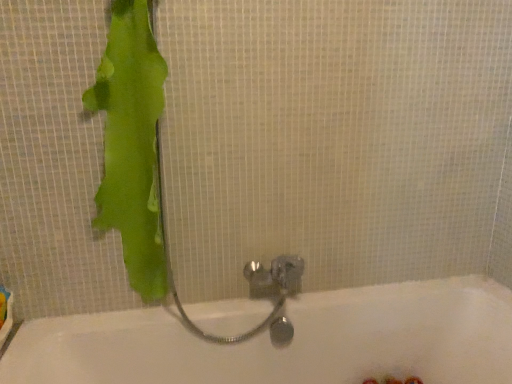
What do you see at coordinates (291, 343) in the screenshot? I see `white glossy bathtub at center` at bounding box center [291, 343].

Locate an element on the screen. This screenshot has width=512, height=384. white glossy bathtub at center is located at coordinates (291, 343).

Identify the location of green matte towel at left. (131, 144).

What do you see at coordinates (131, 144) in the screenshot? The width and height of the screenshot is (512, 384). I see `green matte towel at left` at bounding box center [131, 144].

Locate an element on the screen. The width and height of the screenshot is (512, 384). white glossy bathtub at center is located at coordinates (291, 343).

Considering the positions of objects green matte towel at left and white glossy bathtub at center in the image provided, who is more to the right, green matte towel at left or white glossy bathtub at center?

Positioned to the right is white glossy bathtub at center.

Relative to white glossy bathtub at center, is green matte towel at left in front or behind?

green matte towel at left is behind white glossy bathtub at center.

Is point (141, 98) farther from camera compared to point (168, 381)?

That is False.

Looking at this image, from the image's perspective, is green matte towel at left under white glossy bathtub at center?

Actually, green matte towel at left appears above white glossy bathtub at center in the image.

From a real-world perspective, which is physically below, green matte towel at left or white glossy bathtub at center?

white glossy bathtub at center, from a real-world perspective.

Considering the relative sizes of green matte towel at left and white glossy bathtub at center in the image provided, is green matte towel at left wider than white glossy bathtub at center?

In fact, green matte towel at left might be narrower than white glossy bathtub at center.

Between green matte towel at left and white glossy bathtub at center, which one has less height?

white glossy bathtub at center is shorter.

Is green matte towel at left bigger or smaller than white glossy bathtub at center?

Clearly, green matte towel at left is smaller in size than white glossy bathtub at center.

Is green matte towel at left inside or outside of white glossy bathtub at center?

green matte towel at left is not inside white glossy bathtub at center, it's outside.

Is green matte towel at left not close to white glossy bathtub at center?

No, green matte towel at left is in close proximity to white glossy bathtub at center.

Could you tell me if green matte towel at left is facing white glossy bathtub at center?

No.

Based on the photo, can you tell me how much green matte towel at left and white glossy bathtub at center differ in facing direction?

0.0342 degrees.

Identify the location of animal above the white glossy bathtub at center (from a real-world perspective). (131, 144).

In the image, is white glossy bathtub at center on the left side or the right side of green matte towel at left?

Based on their positions, white glossy bathtub at center is located to the right of green matte towel at left.

In the scene shown: Which object is closer to the camera taking this photo, white glossy bathtub at center or green matte towel at left?

white glossy bathtub at center is in front.

Between point (455, 314) and point (158, 84), which one is positioned behind?

Positioned behind is point (455, 314).

From the image's perspective, is white glossy bathtub at center over green matte towel at left?

No, from the image's perspective, white glossy bathtub at center is not on top of green matte towel at left.

From a real-world perspective, which object rests below the other?

white glossy bathtub at center is physically lower.

Based on the photo, can you confirm if white glossy bathtub at center is wider than green matte towel at left?

Yes.

Between white glossy bathtub at center and green matte towel at left, which one has more height?

With more height is green matte towel at left.

Consider the image. Who is bigger, white glossy bathtub at center or green matte towel at left?

white glossy bathtub at center is bigger.

Could green matte towel at left be considered to be inside white glossy bathtub at center?

No, white glossy bathtub at center does not contain green matte towel at left.

Is white glossy bathtub at center placed right next to green matte towel at left?

There is a gap between white glossy bathtub at center and green matte towel at left.

From the picture: Is white glossy bathtub at center aimed at green matte towel at left?

No, white glossy bathtub at center is not facing towards green matte towel at left.

How many degrees apart are the facing directions of white glossy bathtub at center and green matte towel at left?

The angular difference between white glossy bathtub at center and green matte towel at left is 0.0342 degrees.

Locate an element on the screen. The image size is (512, 384). bathtub on the right of green matte towel at left is located at coordinates (291, 343).

Image resolution: width=512 pixels, height=384 pixels. In the image, there is a green matte towel at left. In order to click on bathtub below it (from the image's perspective) in this screenshot , I will do `click(291, 343)`.

Locate an element on the screen. The width and height of the screenshot is (512, 384). bathtub below the green matte towel at left (from a real-world perspective) is located at coordinates (291, 343).